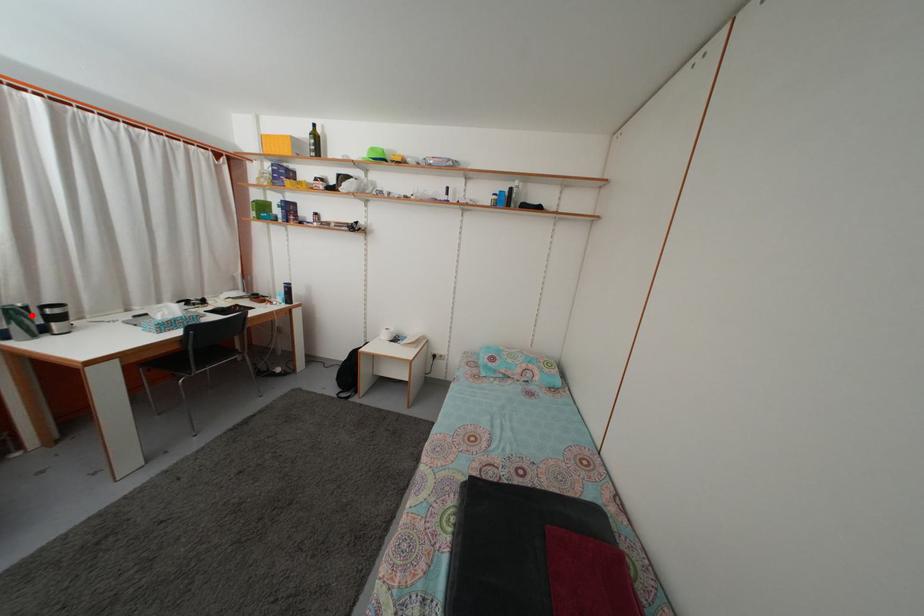
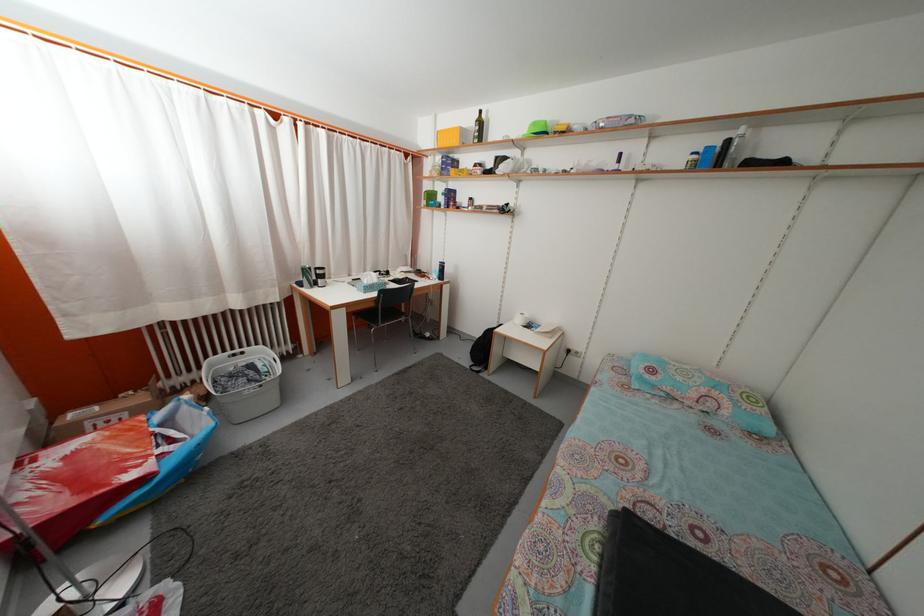
Find the pixel in the second image that matches the highlighted location in the first image.

(315, 276)